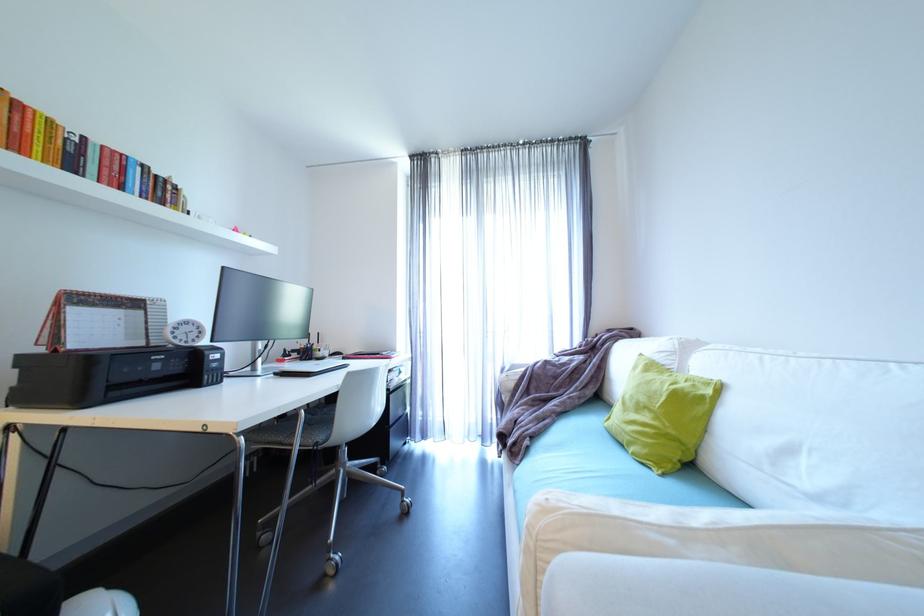
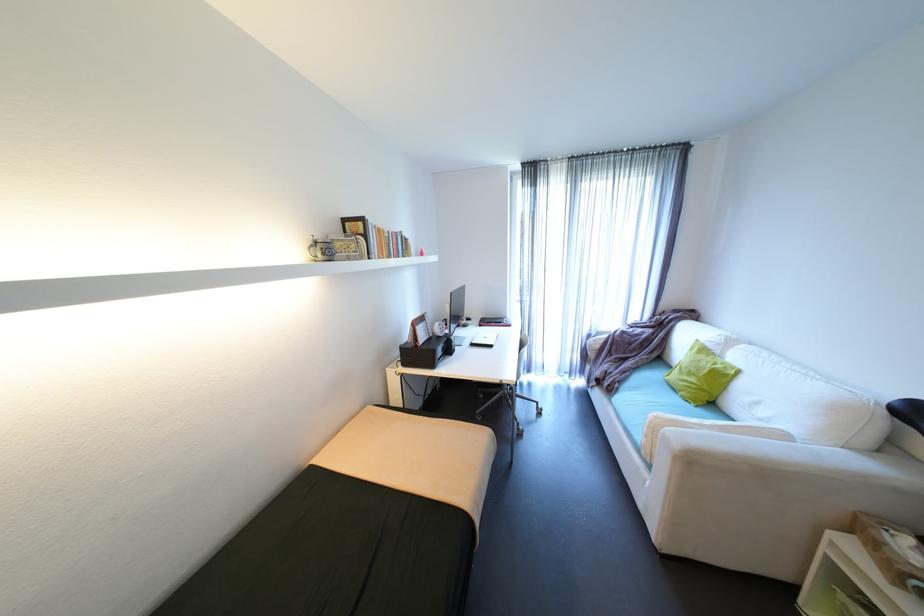
Where in the second image is the point corresponding to pixel 385 354 from the first image?

(508, 323)